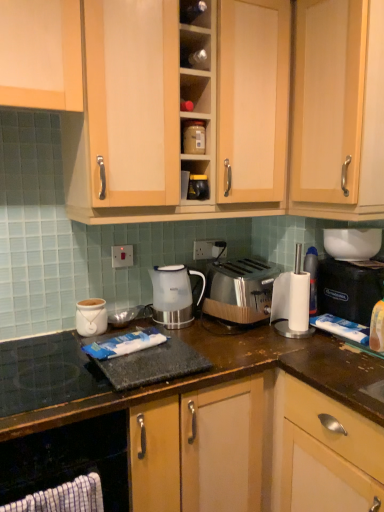
Question: Is satin silver toaster at center taller or shorter than white glossy bowl at upper right, the 4th appliance from the left?

Choices:
 (A) short
 (B) tall

Answer: (B)

Question: From the image's perspective, is satin silver toaster at center located above or below white glossy bowl at upper right, which appears as the second appliance when ordered from the bottom?

Choices:
 (A) above
 (B) below

Answer: (B)

Question: Which object is the farthest from the light wood cabinet at upper right, positioned as the 2th cabinetry in bottom-to-top order?

Choices:
 (A) matte plastic container at upper center, marked as the fourth appliance in a bottom-to-top arrangement
 (B) white glossy bowl at upper right, which appears as the second appliance when ordered from the bottom
 (C) black plastic coffee machine at right
 (D) satin silver toaster at center
 (E) black rubber mat at lower left

Answer: (E)

Question: Which object is positioned farthest from the black plastic coffee machine at right?

Choices:
 (A) white ceramic jar at center, the fourth appliance when ordered from top to bottom
 (B) white glossy bowl at upper right, the 4th appliance from the left
 (C) light wood cabinet at upper center, which is the first cabinetry from top to bottom
 (D) light wood cabinet at upper right, the second cabinetry when ordered from top to bottom
 (E) matte plastic container at upper center, positioned as the first appliance in top-to-bottom order

Answer: (A)